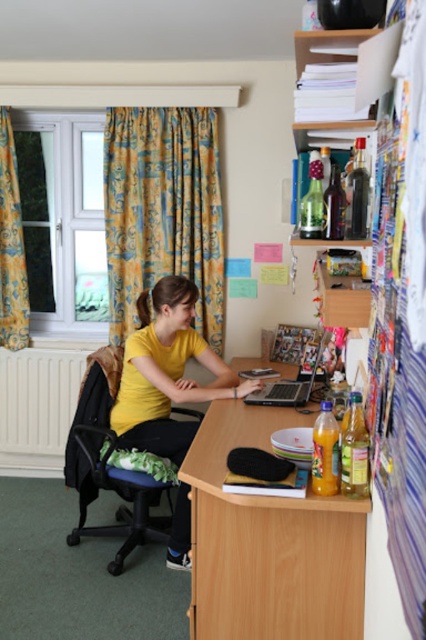
From the picture: You are a visitor entering the room and want to sit down. The green fabric swivel chair at left and the yellow patterned curtain at left are both in your line of sight. Which object would you need to move closer to reach first?

The green fabric swivel chair at left is bigger than the yellow patterned curtain at left, so you would need to move closer to reach the yellow patterned curtain at left first.

You are a student who just entered the room and need to place your new laptop on the desk. The desk has limited space. Can you tell me if the yellow patterned curtain at left is blocking the area where the satin silver laptop at center is currently placed?

The yellow patterned curtain at left is located above the satin silver laptop at center, so it is not blocking the area where the laptop is placed. You can safely place your new laptop there.

You are organizing a small party in this room and need to decide where to place a 1.2m tall table. Considering the green fabric swivel chair at left and the yellow patterned curtain at left, which object is shorter and thus safer to place the table near without blocking the view?

The green fabric swivel chair at left is shorter than the yellow patterned curtain at left, so placing the table near the green fabric swivel chair at left would be safer to avoid blocking the view.